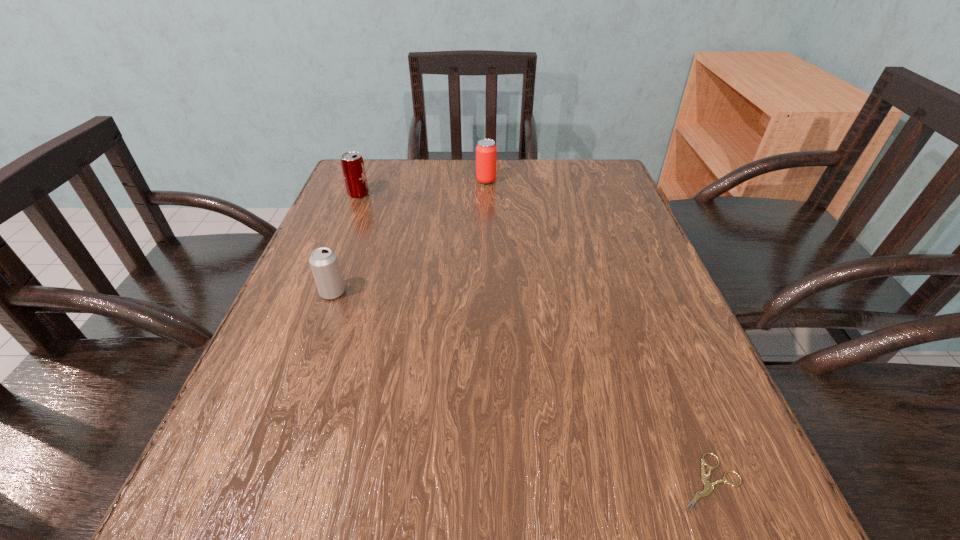
Where is `the farthest beer can`? the farthest beer can is located at coordinates (486, 152).

Identify the location of the farthest object. Image resolution: width=960 pixels, height=540 pixels. (486, 152).

I want to click on the second farthest object, so [x=352, y=163].

In order to click on the third farthest object in this screenshot , I will do `click(323, 261)`.

This screenshot has width=960, height=540. Find the location of `the rightmost object`. the rightmost object is located at coordinates (708, 487).

At what (x,y) coordinates should I click in order to perform the action: click on the shortest object. Please return your answer as a coordinate pair (x, y). Looking at the image, I should click on tap(708, 487).

The width and height of the screenshot is (960, 540). What are the coordinates of `vacant space located on the back of the third object from left to right` in the screenshot? It's located at (486, 161).

The width and height of the screenshot is (960, 540). Find the location of `vacant space located on the front of the third nearest object`. vacant space located on the front of the third nearest object is located at coordinates (326, 275).

In order to click on free spot located 0.210m on the right of the third farthest object in this screenshot , I will do `click(454, 293)`.

Locate an element on the screen. free spot located 0.330m on the back of the rightmost object is located at coordinates (634, 291).